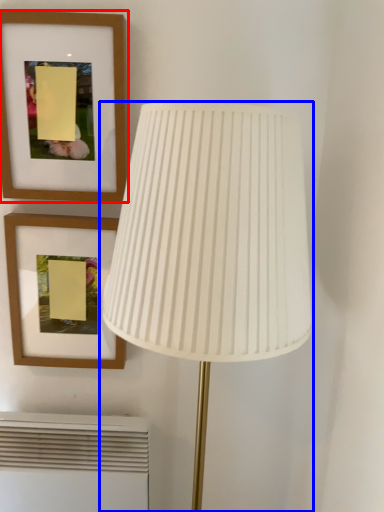
Question: Which of the following is the closest to the observer, picture frame (highlighted by a red box) or lamp (highlighted by a blue box)?

Choices:
 (A) picture frame
 (B) lamp

Answer: (B)